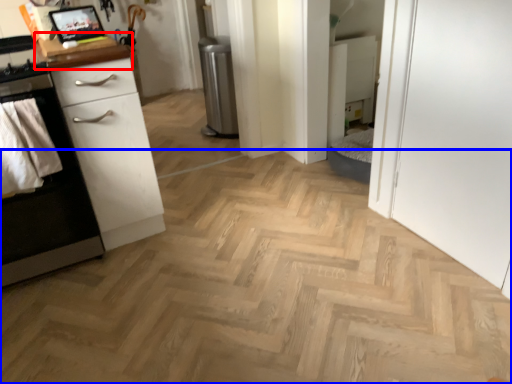
Question: Which object appears farthest to the camera in this image, counter top (highlighted by a red box) or plain (highlighted by a blue box)?

Choices:
 (A) counter top
 (B) plain

Answer: (A)